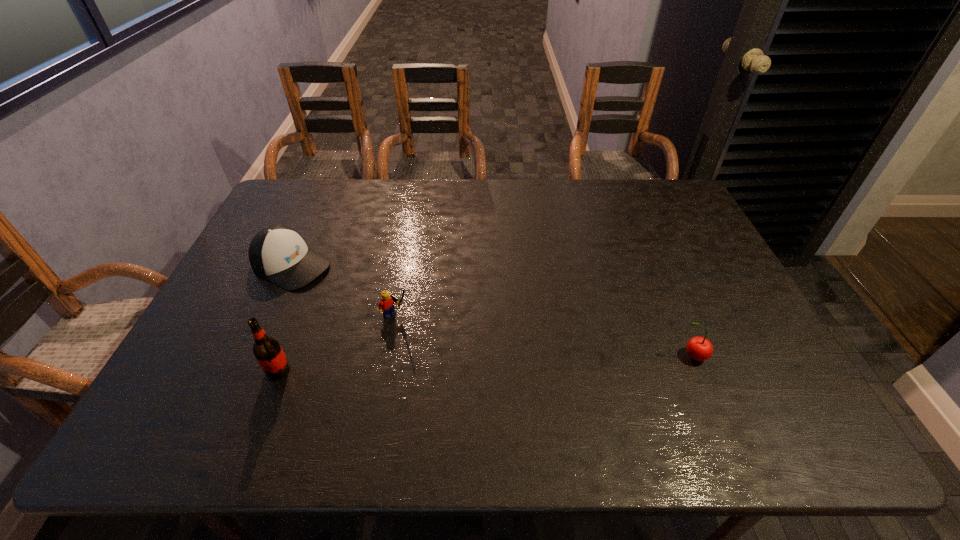
Identify the location of blank region between the root beer and the third object from left to right. (337, 343).

This screenshot has height=540, width=960. Find the location of `unoccupied position between the second farthest object and the root beer`. unoccupied position between the second farthest object and the root beer is located at coordinates (337, 343).

The width and height of the screenshot is (960, 540). In order to click on free space between the tallest object and the rightmost object in this screenshot , I will do `click(485, 363)`.

The height and width of the screenshot is (540, 960). Identify the location of empty space between the second farthest object and the cherry. (544, 336).

In order to click on vacant space that is in between the cap and the third object from left to right in this screenshot , I will do `click(344, 291)`.

What are the coordinates of `vacant space in between the cap and the cherry` in the screenshot? It's located at (492, 311).

Where is `vacant area that lies between the tallest object and the Lego`? The height and width of the screenshot is (540, 960). vacant area that lies between the tallest object and the Lego is located at coordinates (337, 343).

This screenshot has height=540, width=960. In order to click on free spot between the root beer and the cherry in this screenshot , I will do `click(485, 363)`.

The width and height of the screenshot is (960, 540). Identify the location of free space that is in between the third object from left to right and the root beer. (337, 343).

Locate an element on the screen. The width and height of the screenshot is (960, 540). the second closest object relative to the cap is located at coordinates (267, 350).